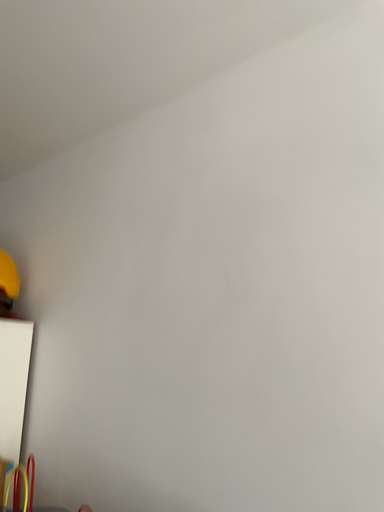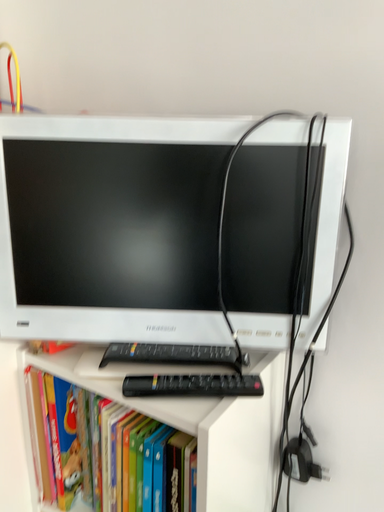
Question: Which way did the camera rotate in the video?

Choices:
 (A) rotated downward
 (B) rotated upward

Answer: (A)